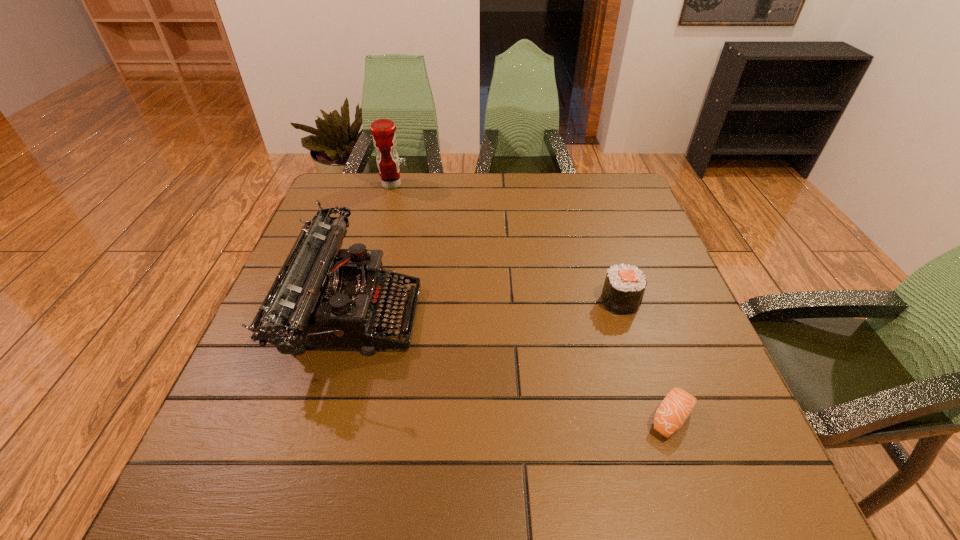
I want to click on object present at the far edge, so click(x=384, y=138).

This screenshot has height=540, width=960. Find the location of `condiment at the left edge`. condiment at the left edge is located at coordinates (384, 138).

I want to click on typewriter present at the left edge, so click(323, 296).

Locate an element on the screen. object positioned at the far left corner is located at coordinates (384, 138).

Find the location of a particular element. The image size is (960, 540). vacant region at the far edge of the desktop is located at coordinates (501, 193).

In the image, there is a desktop. Identify the location of vacant space at the near edge. (338, 501).

At what (x,y) coordinates should I click in order to perform the action: click on vacant space at the left edge of the desktop. Please return your answer as a coordinate pair (x, y). The image size is (960, 540). Looking at the image, I should click on (262, 435).

In the image, there is a desktop. Where is `vacant space at the right edge`? This screenshot has width=960, height=540. vacant space at the right edge is located at coordinates (674, 436).

Identify the location of free space at the far left corner. (369, 202).

Identify the location of vacant space at the near left corner of the desktop. The width and height of the screenshot is (960, 540). (210, 502).